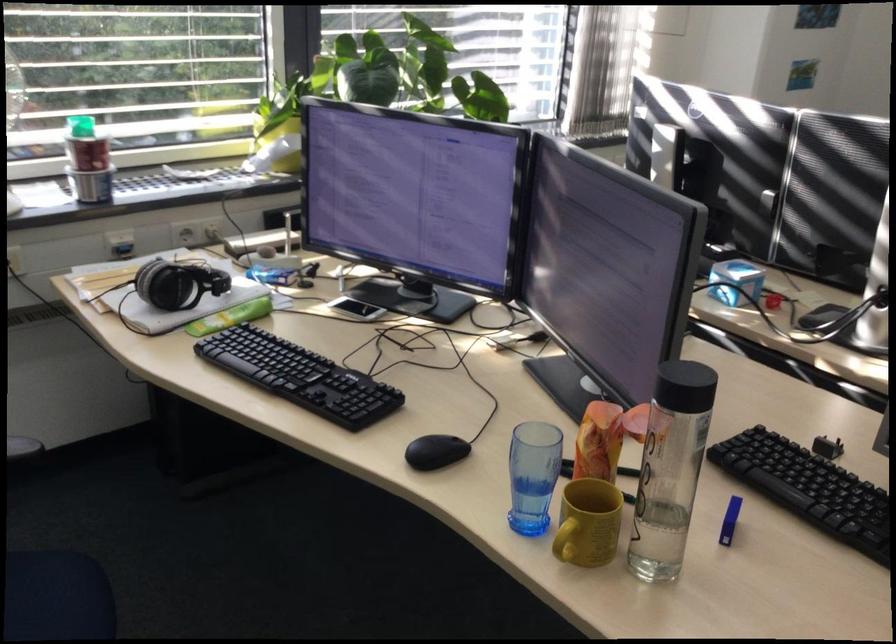
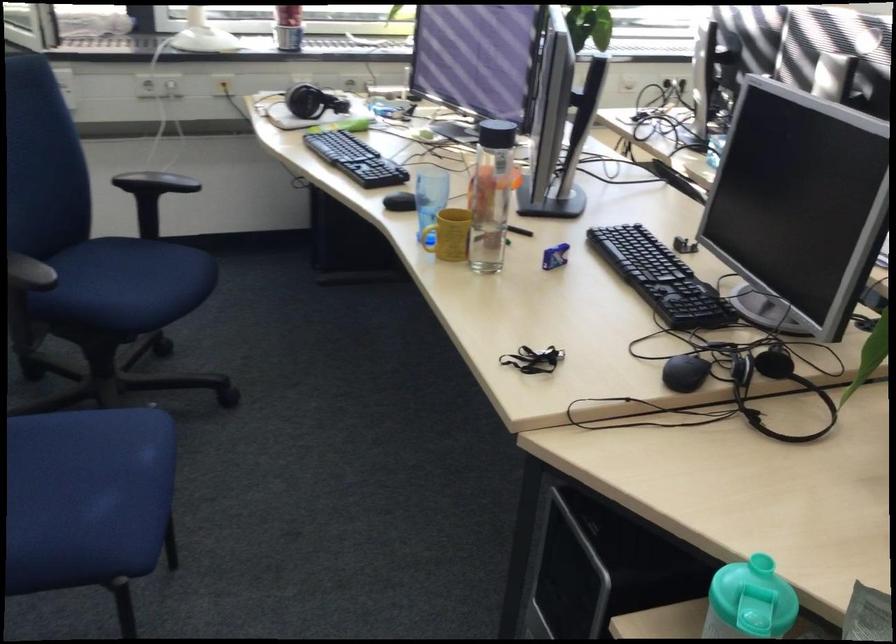
The images are taken continuously from a first-person perspective. In which direction are you moving?

The movement direction of the cameraman is right, backward.